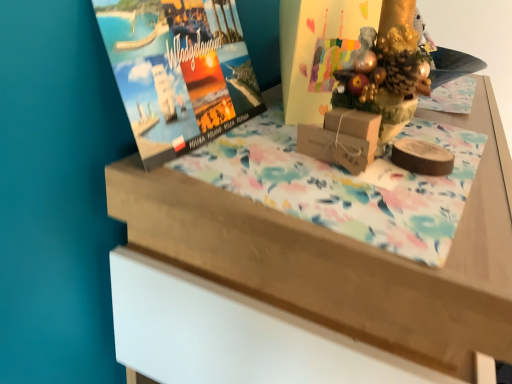
Question: Is wooden table at upper center bigger or smaller than matte cardboard book cover at center?

Choices:
 (A) big
 (B) small

Answer: (A)

Question: From a real-world perspective, is wooden table at upper center above or below matte cardboard book cover at center?

Choices:
 (A) above
 (B) below

Answer: (B)

Question: Which object is the farthest from the brown cardboard box at center?

Choices:
 (A) matte paper magazine at upper left
 (B) wooden table at upper center
 (C) matte cardboard book cover at center

Answer: (B)

Question: Which object is positioned closest to the brown cardboard box at center?

Choices:
 (A) matte paper magazine at upper left
 (B) wooden table at upper center
 (C) matte cardboard book cover at center

Answer: (C)